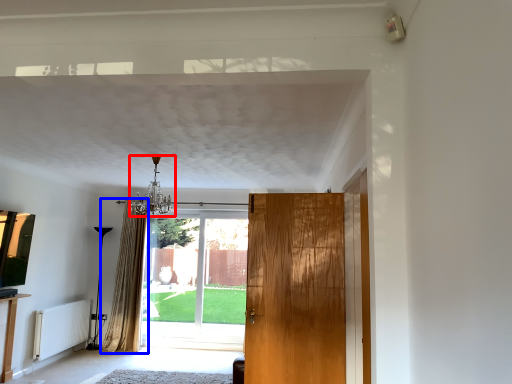
Question: Among these objects, which one is farthest to the camera, light fixture (highlighted by a red box) or curtain (highlighted by a blue box)?

Choices:
 (A) light fixture
 (B) curtain

Answer: (B)